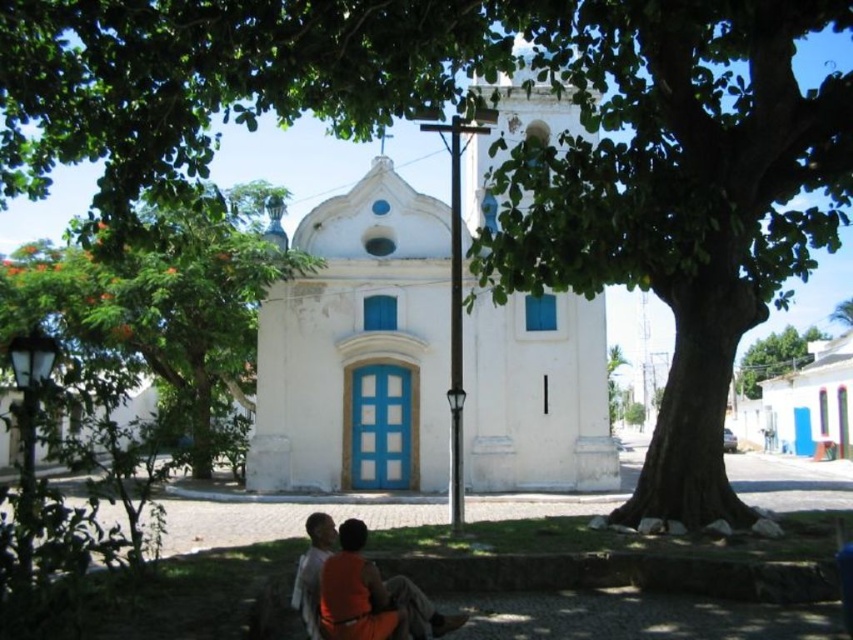
Question: Is green leafy tree at center closer to camera compared to orange fabric shirt at lower center?

Choices:
 (A) yes
 (B) no

Answer: (B)

Question: Among these objects, which one is farthest from the camera?

Choices:
 (A) green leafy tree at center
 (B) orange fabric shirt at lower center
 (C) green leafy tree at upper right

Answer: (C)

Question: Can you confirm if green leafy tree at left is positioned below orange fabric shirt at lower center?

Choices:
 (A) no
 (B) yes

Answer: (A)

Question: Which object is positioned farthest from the orange fabric shirt at lower center?

Choices:
 (A) green leafy tree at center
 (B) green leafy tree at left

Answer: (B)

Question: Considering the real-world distances, which object is farthest from the white smooth chapel at center?

Choices:
 (A) green leafy tree at center
 (B) green leafy tree at upper right
 (C) green leafy tree at left
 (D) orange fabric couple at lower center

Answer: (B)

Question: Can you confirm if green leafy tree at center is positioned to the right of green leafy tree at left?

Choices:
 (A) yes
 (B) no

Answer: (A)